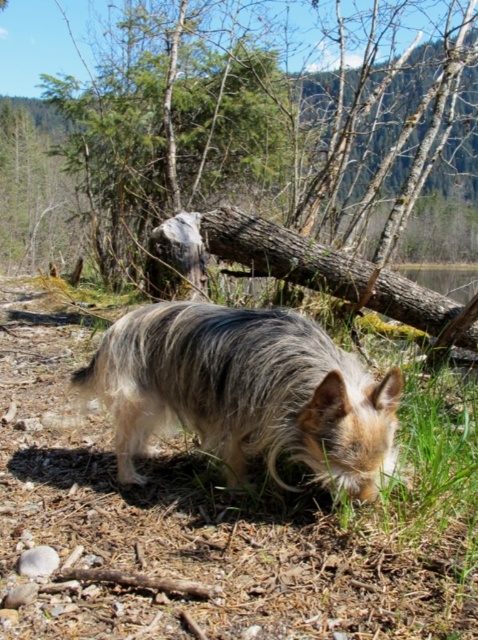
Question: Does green mossy log at center appear over fuzzy fur dog at center?

Choices:
 (A) no
 (B) yes

Answer: (B)

Question: Which of the following is the closest to the observer?

Choices:
 (A) fuzzy fur dog at center
 (B) green mossy log at center

Answer: (A)

Question: From the image, what is the correct spatial relationship of green mossy log at center in relation to fuzzy fur dog at center?

Choices:
 (A) left
 (B) right

Answer: (B)

Question: Can you confirm if green mossy log at center is positioned to the right of fuzzy fur dog at center?

Choices:
 (A) no
 (B) yes

Answer: (B)